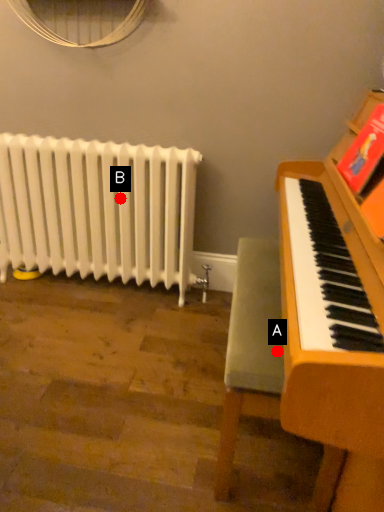
Question: Two points are circled on the image, labeled by A and B beside each circle. Which point is further to the camera?

Choices:
 (A) A is further
 (B) B is further

Answer: (B)